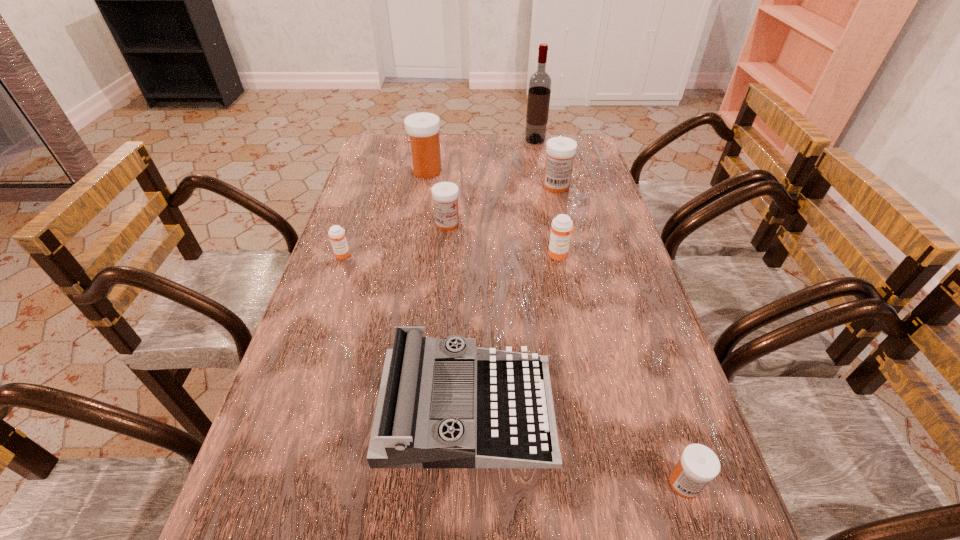
Identify the location of the farthest object. The image size is (960, 540). (539, 91).

Locate an element on the screen. wine bottle is located at coordinates (539, 91).

Identify the location of the tallest medicine. (422, 128).

Identify the location of the biggest white medicine. (422, 128).

Image resolution: width=960 pixels, height=540 pixels. I want to click on the third smallest white medicine, so click(x=560, y=151).

I want to click on the second tallest medicine, so click(x=560, y=151).

Find the location of a particular element. This screenshot has height=540, width=960. the fourth nearest medicine is located at coordinates (445, 195).

The width and height of the screenshot is (960, 540). In order to click on the fifth nearest object in this screenshot , I will do `click(445, 195)`.

The image size is (960, 540). What are the coordinates of `the bigger orange medicine` in the screenshot? It's located at (562, 226).

This screenshot has width=960, height=540. Identify the location of typewriter. pos(443,402).